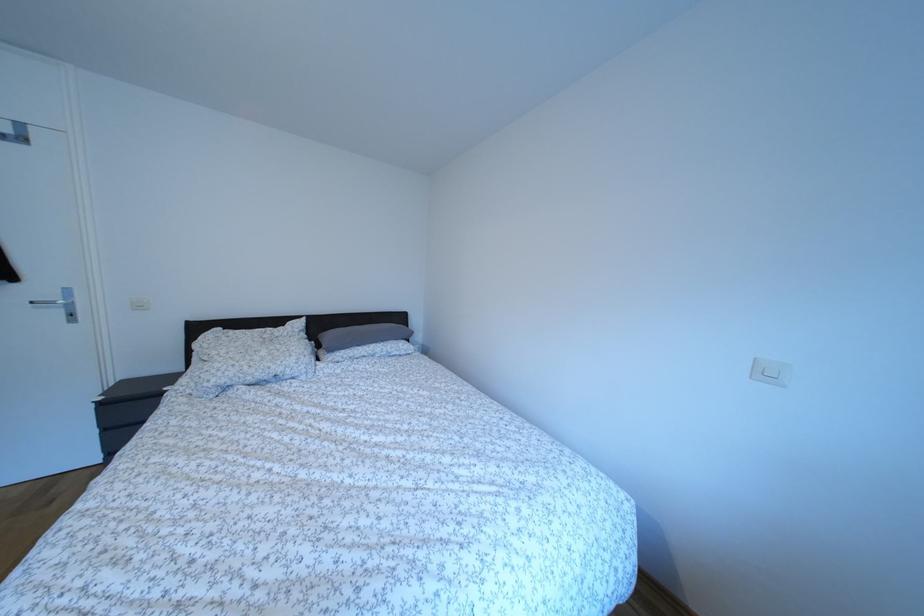
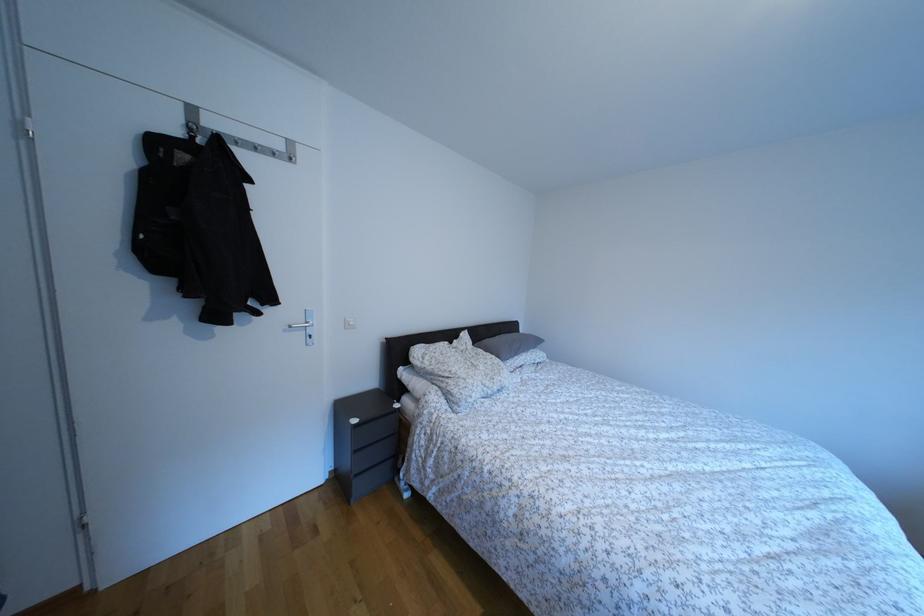
Question: What movement of the cameraman would produce the second image?

Choices:
 (A) Left
 (B) Right
 (C) Forward
 (D) Backward

Answer: (A)